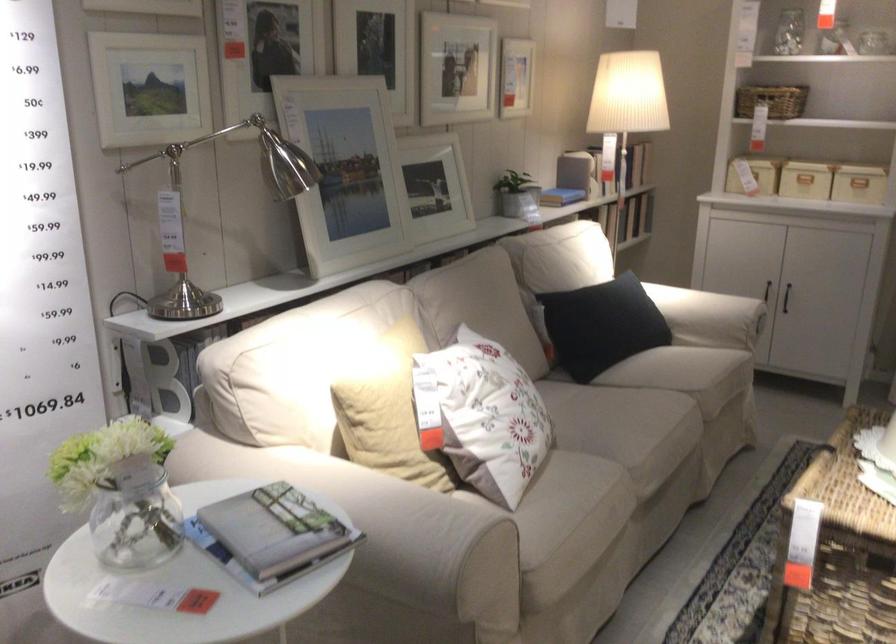
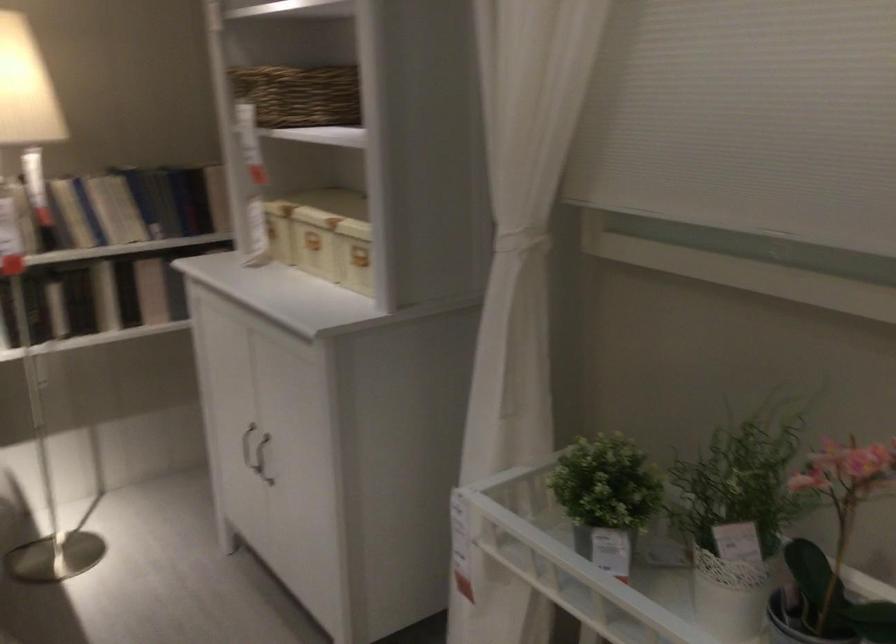
Question: I am providing you with two images of the same scene from different viewpoints. Which of the following objects are not visible in image2?

Choices:
 (A) small black vase
 (B) beige storage box
 (C) black cabinet handle
 (D) potted green plant

Answer: (C)